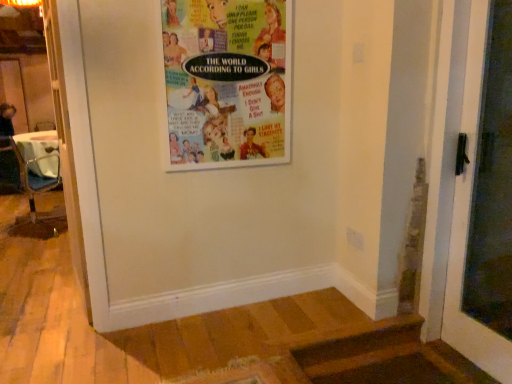
Question: In terms of size, does metallic silver chair at left appear bigger or smaller than white glossy door at right?

Choices:
 (A) big
 (B) small

Answer: (A)

Question: From the image's perspective, is metallic silver chair at left located above or below white glossy door at right?

Choices:
 (A) below
 (B) above

Answer: (B)

Question: Estimate the real-world distances between objects in this image. Which object is closer to the multicolored paper poster at upper center?

Choices:
 (A) white glossy door at right
 (B) metallic silver chair at left

Answer: (A)

Question: Considering the real-world distances, which object is farthest from the white glossy door at right?

Choices:
 (A) metallic silver chair at left
 (B) multicolored paper poster at upper center

Answer: (A)